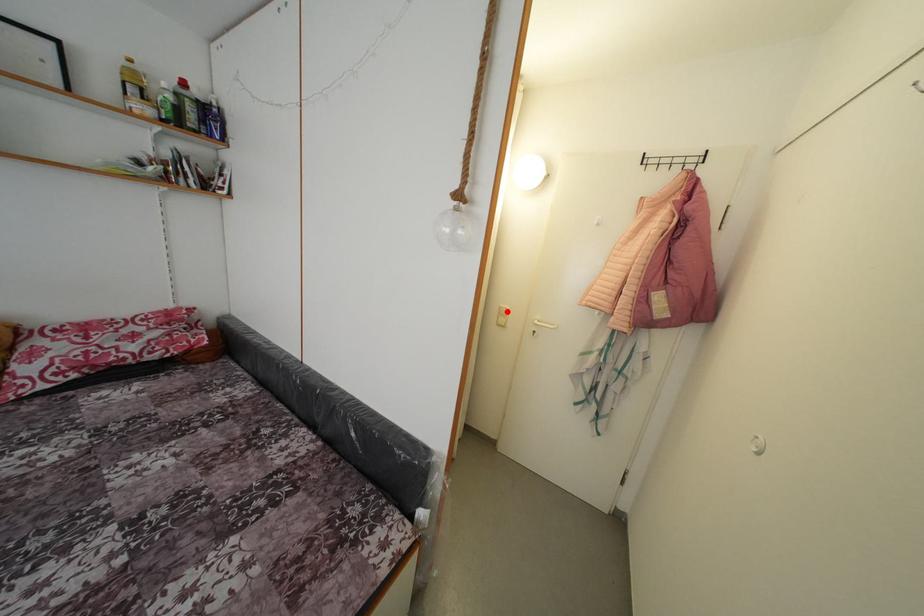
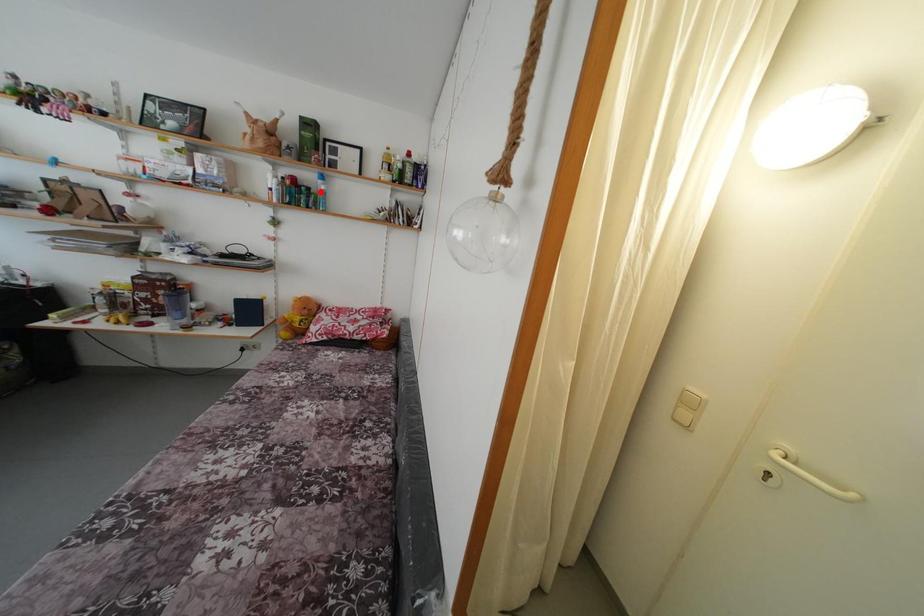
I am providing you with two images of the same scene from different viewpoints. A red point is marked on the first image and another point is marked on the second image. Do the highlighted points in image1 and image2 indicate the same real-world spot?

No